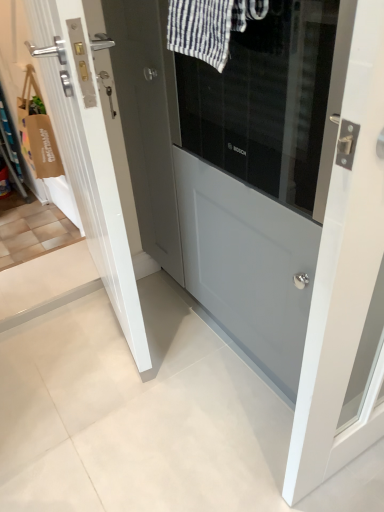
Question: From a real-world perspective, is white glossy door at center, the 2th door from the right, positioned under matte gray door at center, the 2th door viewed from the left, based on gravity?

Choices:
 (A) yes
 (B) no

Answer: (B)

Question: Does white glossy door at center, the 2th door from the right, appear on the left side of matte gray door at center, the 1th door positioned from the right?

Choices:
 (A) yes
 (B) no

Answer: (A)

Question: From the image's perspective, is white glossy door at center, which ranks as the first door in left-to-right order, located beneath matte gray door at center, the 1th door positioned from the right?

Choices:
 (A) no
 (B) yes

Answer: (A)

Question: Would you say white glossy door at center, which ranks as the first door in left-to-right order, contains matte gray door at center, the 1th door positioned from the right?

Choices:
 (A) no
 (B) yes

Answer: (A)

Question: Is white glossy door at center, the 2th door from the right, to the right of matte gray door at center, the 2th door viewed from the left, from the viewer's perspective?

Choices:
 (A) no
 (B) yes

Answer: (A)

Question: Is white glossy door at center, the 2th door from the right, with matte gray door at center, the 2th door viewed from the left?

Choices:
 (A) yes
 (B) no

Answer: (B)

Question: Are white striped fabric at upper center and white glossy door at center, the 2th door from the right, far apart?

Choices:
 (A) no
 (B) yes

Answer: (A)

Question: Is white striped fabric at upper center positioned in front of white glossy door at center, the 2th door from the right?

Choices:
 (A) no
 (B) yes

Answer: (B)

Question: Would you say white striped fabric at upper center contains white glossy door at center, the 2th door from the right?

Choices:
 (A) yes
 (B) no

Answer: (B)

Question: Is white striped fabric at upper center to the right of white glossy door at center, the 2th door from the right, from the viewer's perspective?

Choices:
 (A) yes
 (B) no

Answer: (A)

Question: Would you say white striped fabric at upper center is outside white glossy door at center, the 2th door from the right?

Choices:
 (A) yes
 (B) no

Answer: (A)

Question: Is white striped fabric at upper center oriented away from white glossy door at center, the 2th door from the right?

Choices:
 (A) no
 (B) yes

Answer: (A)

Question: From a real-world perspective, is white glossy door at center, the 2th door from the right, physically below white striped fabric at upper center?

Choices:
 (A) no
 (B) yes

Answer: (B)